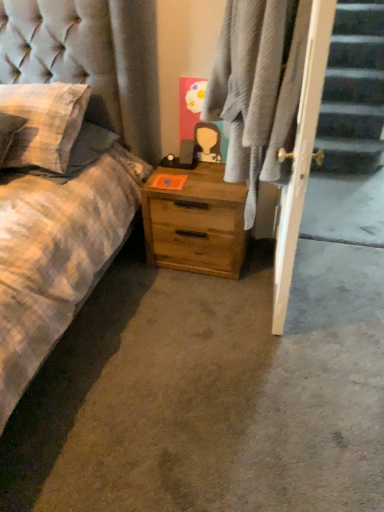
This screenshot has width=384, height=512. I want to click on vacant region above wooden nightstand at center (from a real-world perspective), so click(x=194, y=173).